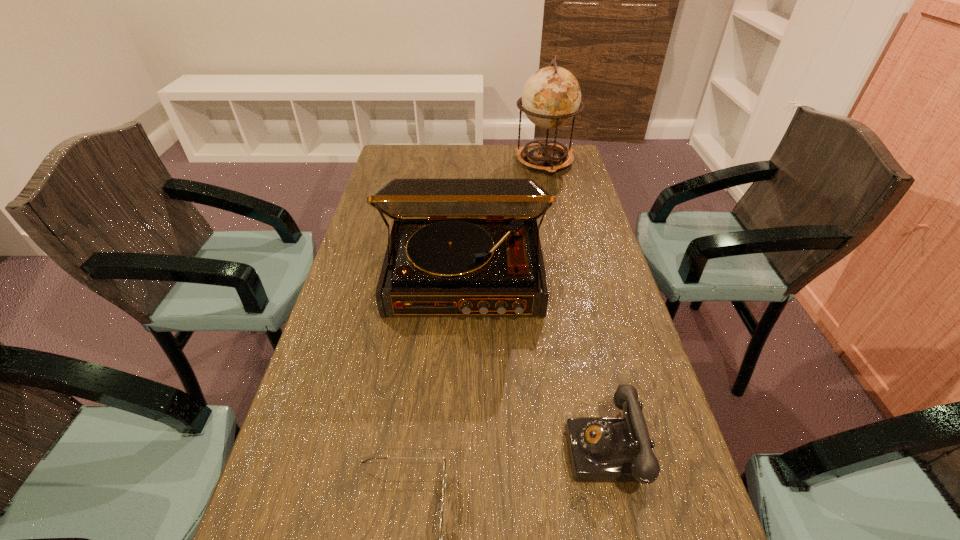
The height and width of the screenshot is (540, 960). What are the coordinates of `object that is at the far edge` in the screenshot? It's located at 551,97.

Find the location of a particular element. object situated at the left edge is located at coordinates (458, 246).

Locate an element on the screen. This screenshot has width=960, height=540. globe that is at the right edge is located at coordinates point(551,97).

At what (x,y) coordinates should I click in order to perform the action: click on telephone present at the right edge. Please return your answer as a coordinate pair (x, y). Looking at the image, I should click on (601, 449).

What are the coordinates of `object that is at the far right corner` in the screenshot? It's located at (551, 97).

Where is `vacant space at the left edge of the desktop`? This screenshot has height=540, width=960. vacant space at the left edge of the desktop is located at coordinates (311, 368).

Identify the location of free space at the right edge. This screenshot has height=540, width=960. (557, 183).

Identify which object is located as the third nearest to the tallest object. Please provide its 2D coordinates. Your answer should be formatted as a tuple, i.e. [(x, y)], where the tuple contains the x and y coordinates of a point satisfying the conditions above.

[(444, 466)]

Identify which object is the third closest to the second farthest object. Please provide its 2D coordinates. Your answer should be formatted as a tuple, i.e. [(x, y)], where the tuple contains the x and y coordinates of a point satisfying the conditions above.

[(551, 97)]

Find the location of a particular element. The height and width of the screenshot is (540, 960). free space in the image that satisfies the following two spatial constraints: 1. at the center of the globe; 2. on the dial of the telephone is located at coordinates (610, 448).